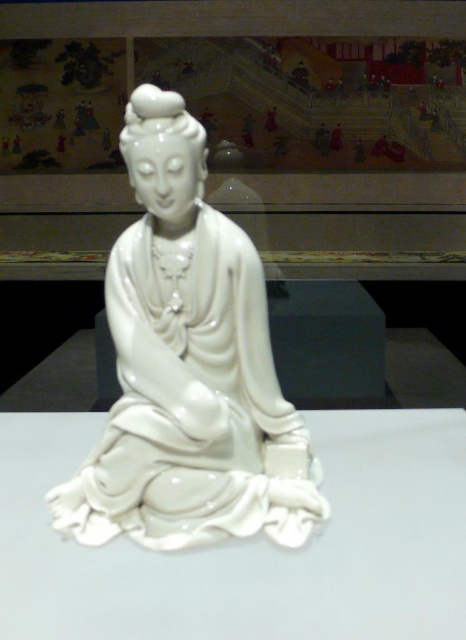
Between white glossy table at center and glossy porcelain statue at center, which one is positioned lower?

white glossy table at center

Does white glossy table at center come in front of glossy porcelain statue at center?

Yes, it is.

Where is `white glossy table at center`? This screenshot has width=466, height=640. white glossy table at center is located at coordinates (251, 545).

Locate an element on the screen. This screenshot has width=466, height=640. white glossy table at center is located at coordinates 251,545.